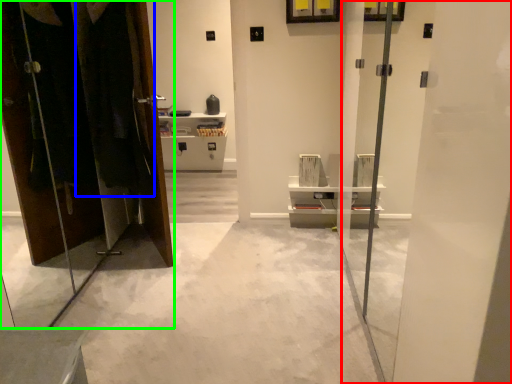
Question: Considering the real-world distances, which object is farthest from screen door (highlighted by a red box)? laundry (highlighted by a blue box) or dresser (highlighted by a green box)?

Choices:
 (A) laundry
 (B) dresser

Answer: (B)